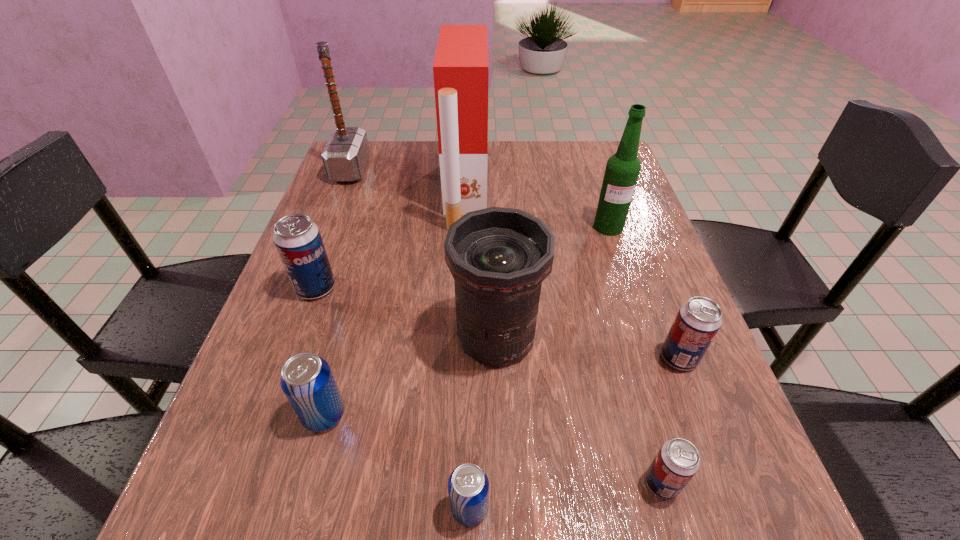
Where is `vacant region between the right blue beer can and the beer bottle`? vacant region between the right blue beer can and the beer bottle is located at coordinates 539,367.

What are the coordinates of `unoccupied area between the leftmost beer can and the third nearest object` in the screenshot? It's located at (320, 351).

The width and height of the screenshot is (960, 540). I want to click on object that stands as the seventh closest to the third beer can from right to left, so click(x=622, y=170).

Find the location of a particular element. Image resolution: width=960 pixels, height=540 pixels. object that is the eighth closest to the beer bottle is located at coordinates (x=307, y=381).

This screenshot has height=540, width=960. I want to click on the fourth closest beer can to the smaller blue beer can, so click(x=298, y=241).

Locate an element on the screen. beer can identified as the third closest to the nearest red beer can is located at coordinates (307, 381).

Choose which red beer can is the second nearest neighbor to the red cigarette case. Please provide its 2D coordinates. Your answer should be formatted as a tuple, i.e. [(x, y)], where the tuple contains the x and y coordinates of a point satisfying the conditions above.

[(698, 320)]

Select which red beer can is the third closest to the right blue beer can. Please provide its 2D coordinates. Your answer should be formatted as a tuple, i.e. [(x, y)], where the tuple contains the x and y coordinates of a point satisfying the conditions above.

[(298, 241)]

Identify the location of vacant space that satisfies the following two spatial constraints: 1. on the front-facing side of the second red beer can from right to left; 2. on the left side of the cigarette case. The image size is (960, 540). (454, 483).

In order to click on vacant area that satisfies the following two spatial constraints: 1. on the front-facing side of the red cigarette case; 2. on the right side of the second smallest red beer can in this screenshot , I will do `click(460, 357)`.